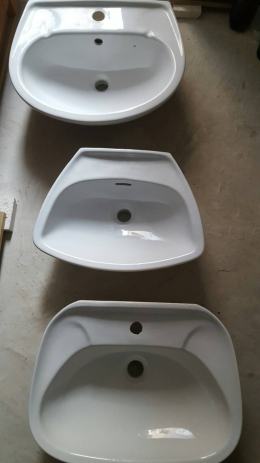
Locate an element on the screen. The height and width of the screenshot is (463, 260). faucet hole is located at coordinates (134, 330), (123, 216), (96, 15).